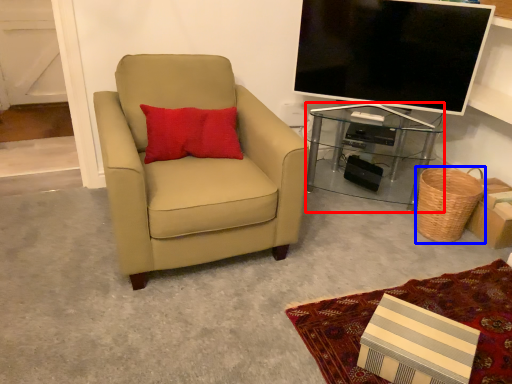
Question: Which object appears farthest to the camera in this image, desk (highlighted by a red box) or basket (highlighted by a blue box)?

Choices:
 (A) desk
 (B) basket

Answer: (A)